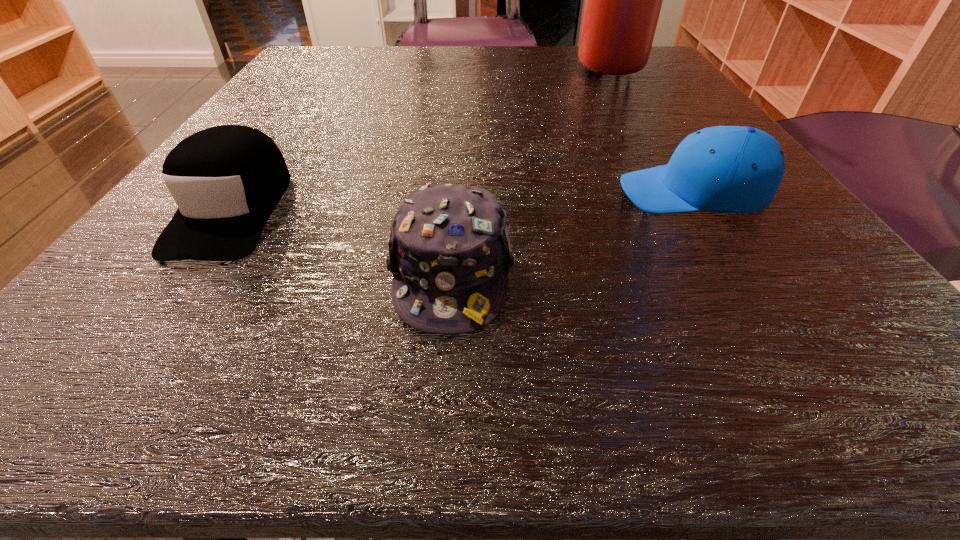
This screenshot has width=960, height=540. I want to click on fire extinguisher, so click(x=623, y=0).

Find the location of a particular element. The width and height of the screenshot is (960, 540). the farthest object is located at coordinates (623, 0).

Where is `the rightmost headwear`? Image resolution: width=960 pixels, height=540 pixels. the rightmost headwear is located at coordinates (726, 169).

The width and height of the screenshot is (960, 540). In order to click on the leftmost object in this screenshot , I will do [226, 180].

Find the location of a particular element. The width and height of the screenshot is (960, 540). the second object from left to right is located at coordinates (449, 250).

What are the coordinates of `free space located 0.340m on the instruction side of the fire extinguisher` in the screenshot? It's located at (414, 64).

Image resolution: width=960 pixels, height=540 pixels. Find the location of `free location located 0.170m on the instruction side of the fire extinguisher`. free location located 0.170m on the instruction side of the fire extinguisher is located at coordinates (493, 64).

This screenshot has height=540, width=960. What are the coordinates of `free space located on the instruction side of the fire extinguisher` in the screenshot? It's located at (386, 64).

Identify the location of vacant space situated on the front-facing side of the rightmost headwear. The width and height of the screenshot is (960, 540). (516, 192).

Find the location of a particular element. Image resolution: width=960 pixels, height=540 pixels. vacant space located 0.280m on the front-facing side of the rightmost headwear is located at coordinates (410, 192).